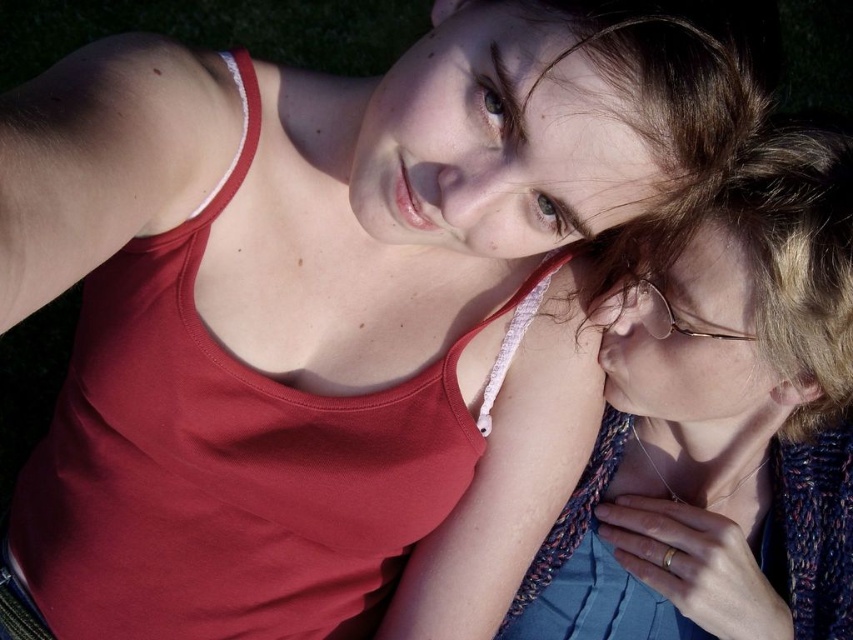
You are a photographer trying to capture a portrait of the two people in the image. Since the knitted blue sweater at right and the green grass at upper left are in the frame, which object would appear larger in your photo?

The knitted blue sweater at right appears larger in the photo because it has a greater height compared to the green grass at upper left.

You are an artist trying to sketch this scene. You want to place the knitted blue sweater at right accurately. What are the coordinates for its position?

The knitted blue sweater at right is located at coordinates 0.670 on the x axis and 0.846 on the y axis.

You are a photographer trying to capture a closeup of the knitted blue sweater at right without the green grass at upper left appearing in the background. Based on the scene, can you achieve this?

Yes, since the knitted blue sweater at right is in front of the green grass at upper left, you can position the camera to focus on the sweater while the grass is out of frame or blurred in the background.